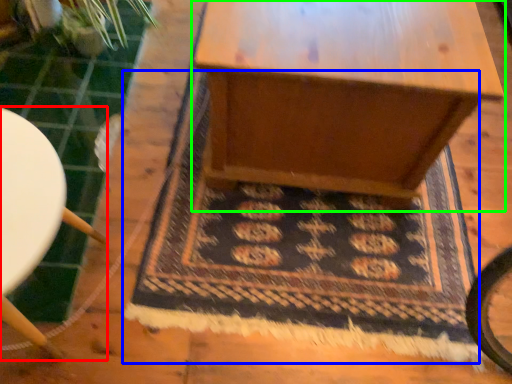
Question: Which object is positioned closest to furniture (highlighted by a red box)? Select from mat (highlighted by a blue box) and table (highlighted by a green box).

Choices:
 (A) mat
 (B) table

Answer: (A)